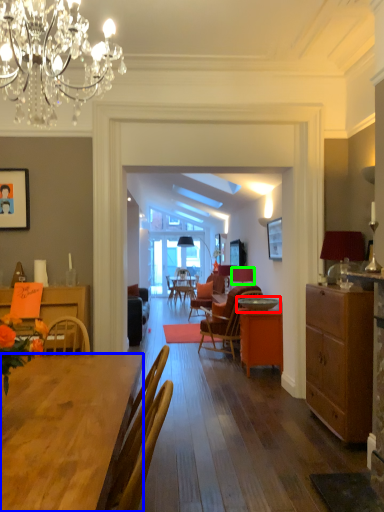
Question: Considering the real-world distances, which object is farthest from round table (highlighted by a red box)? desk (highlighted by a blue box) or lampshade (highlighted by a green box)?

Choices:
 (A) desk
 (B) lampshade

Answer: (A)